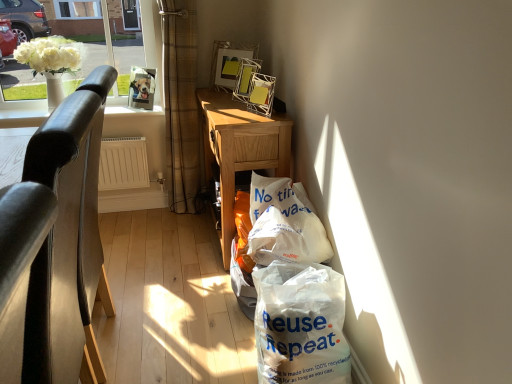
The width and height of the screenshot is (512, 384). What are the coordinates of `empty space that is in between brown plaid curtain at upper left and black leather chair at left` in the screenshot? It's located at (154, 259).